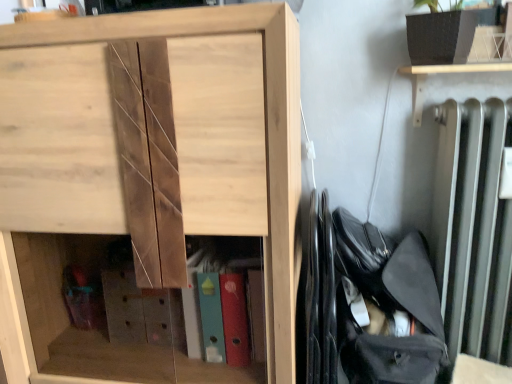
Question: Considering the relative sizes of black fabric bag at right and natural wood cabinet at center in the image provided, is black fabric bag at right smaller than natural wood cabinet at center?

Choices:
 (A) yes
 (B) no

Answer: (A)

Question: Can you confirm if black fabric bag at right is bigger than natural wood cabinet at center?

Choices:
 (A) yes
 (B) no

Answer: (B)

Question: Is black fabric bag at right outside natural wood cabinet at center?

Choices:
 (A) no
 (B) yes

Answer: (B)

Question: Does black fabric bag at right have a lesser height compared to natural wood cabinet at center?

Choices:
 (A) no
 (B) yes

Answer: (B)

Question: Does black fabric bag at right have a lesser width compared to natural wood cabinet at center?

Choices:
 (A) yes
 (B) no

Answer: (A)

Question: From the image's perspective, is black fabric bag at right under natural wood cabinet at center?

Choices:
 (A) yes
 (B) no

Answer: (A)

Question: Does natural wood cabinet at center have a smaller size compared to black fabric bag at right?

Choices:
 (A) yes
 (B) no

Answer: (B)

Question: Does natural wood cabinet at center have a greater height compared to black fabric bag at right?

Choices:
 (A) no
 (B) yes

Answer: (B)

Question: Considering the relative positions of natural wood cabinet at center and black fabric bag at right in the image provided, is natural wood cabinet at center in front of black fabric bag at right?

Choices:
 (A) no
 (B) yes

Answer: (B)

Question: Is the depth of natural wood cabinet at center greater than that of black fabric bag at right?

Choices:
 (A) no
 (B) yes

Answer: (A)

Question: Is black fabric bag at right a part of natural wood cabinet at center?

Choices:
 (A) yes
 (B) no

Answer: (B)

Question: From a real-world perspective, is natural wood cabinet at center on top of black fabric bag at right?

Choices:
 (A) yes
 (B) no

Answer: (A)

Question: In the image, is natural wood cabinet at center positioned in front of or behind black fabric bag at right?

Choices:
 (A) behind
 (B) front

Answer: (B)